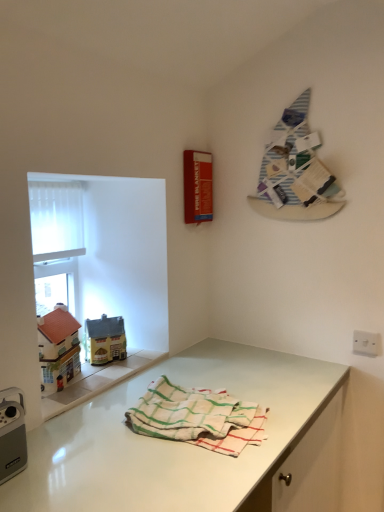
Question: From a real-world perspective, is white glossy countertop at lower center positioned above or below white plastic switch at lower right?

Choices:
 (A) above
 (B) below

Answer: (B)

Question: From the image's perspective, is white glossy countertop at lower center positioned above or below white plastic switch at lower right?

Choices:
 (A) above
 (B) below

Answer: (B)

Question: Which object is positioned closest to the white plastic switch at lower right?

Choices:
 (A) matte yellow house at left, marked as the second toy in a left-to-right arrangement
 (B) striped fabric at upper right
 (C) white glossy countertop at lower center
 (D) white translucent screen at upper left
 (E) white glossy window sill at lower left

Answer: (B)

Question: Which of these objects is positioned closest to the white glossy window sill at lower left?

Choices:
 (A) white glossy countertop at lower center
 (B) white plastic switch at lower right
 (C) white woven towel at center
 (D) white translucent screen at upper left
 (E) matte yellow house at left, which appears as the second toy when viewed from the front

Answer: (E)